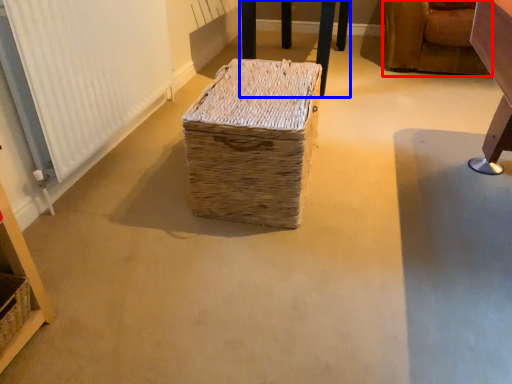
Question: Which object is closer to the camera taking this photo, furniture (highlighted by a red box) or furniture (highlighted by a blue box)?

Choices:
 (A) furniture
 (B) furniture

Answer: (A)